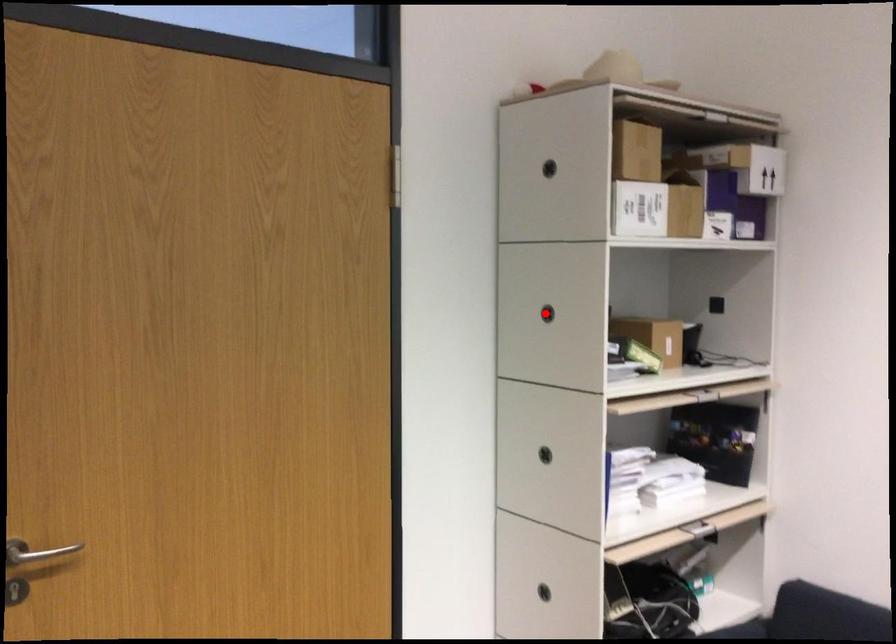
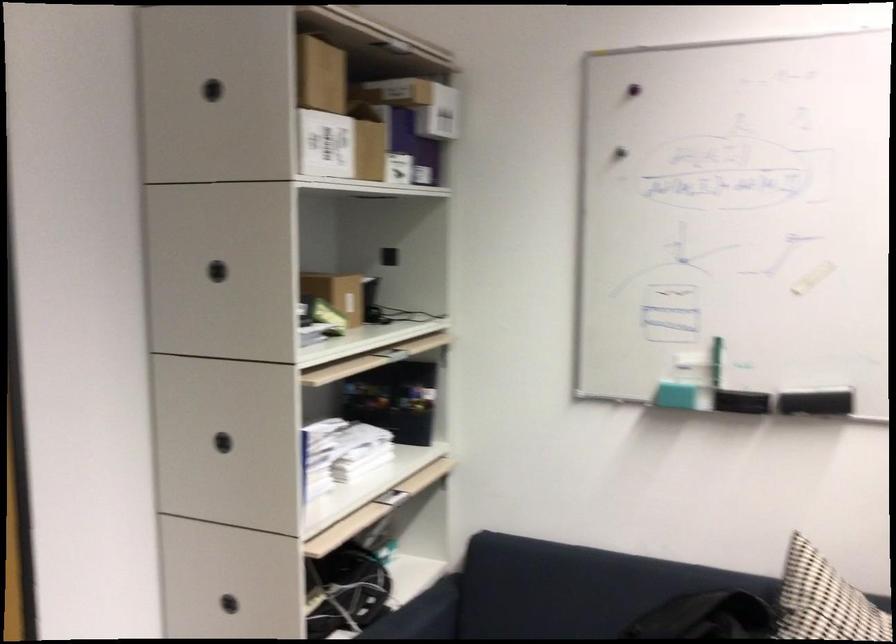
Question: I am providing you with two images of the same scene from different viewpoints. Given a red point in image1, look at the same physical point in image2. Is it:

Choices:
 (A) Closer to the viewpoint
 (B) Farther from the viewpoint

Answer: (A)